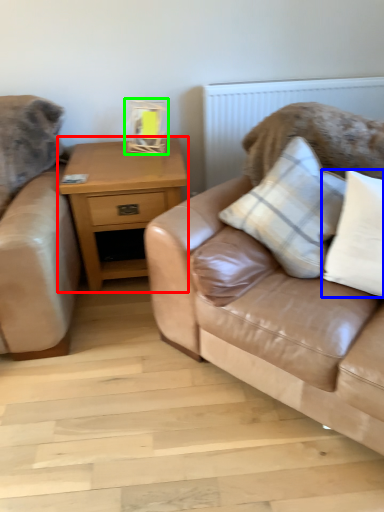
Question: Which is nearer to the nightstand (highlighted by a red box)? pillow (highlighted by a blue box) or table lamp (highlighted by a green box).

Choices:
 (A) pillow
 (B) table lamp

Answer: (B)